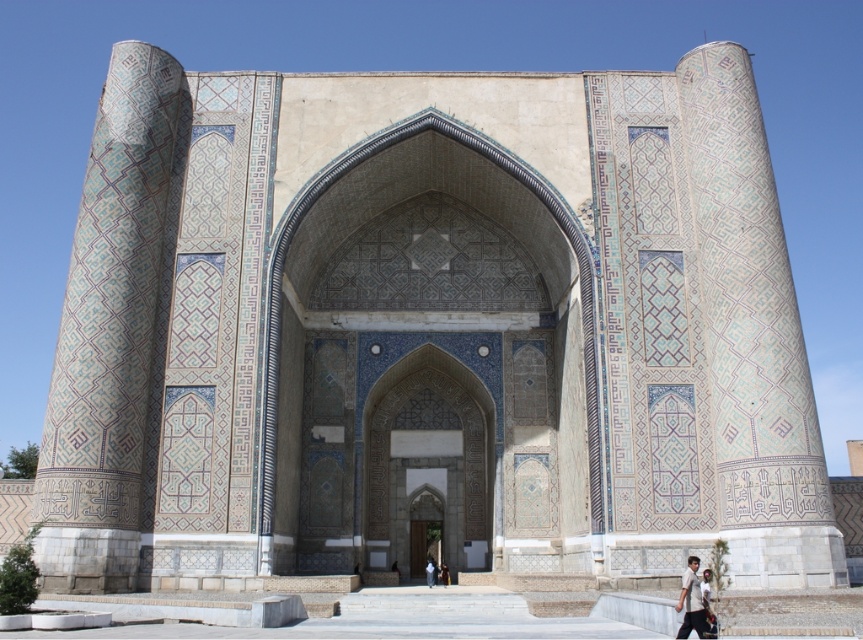
Based on the scene description, where is the blue mosaic pillar at left located in terms of its 2D coordinates?

The blue mosaic pillar at left is located at the 2D coordinates of point (108, 333).